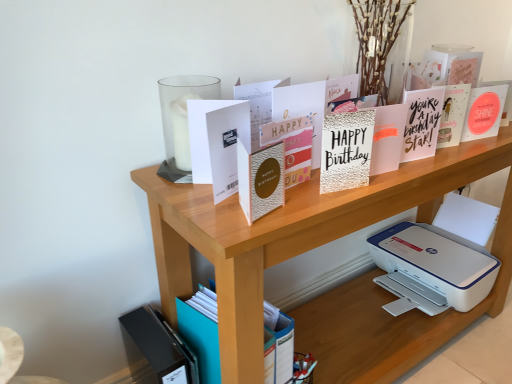
Locate an element on the screen. Image resolution: width=512 pixels, height=384 pixels. free spot to the right of matte gold card at center, which is the 6th paperback book in right-to-left order is located at coordinates (314, 206).